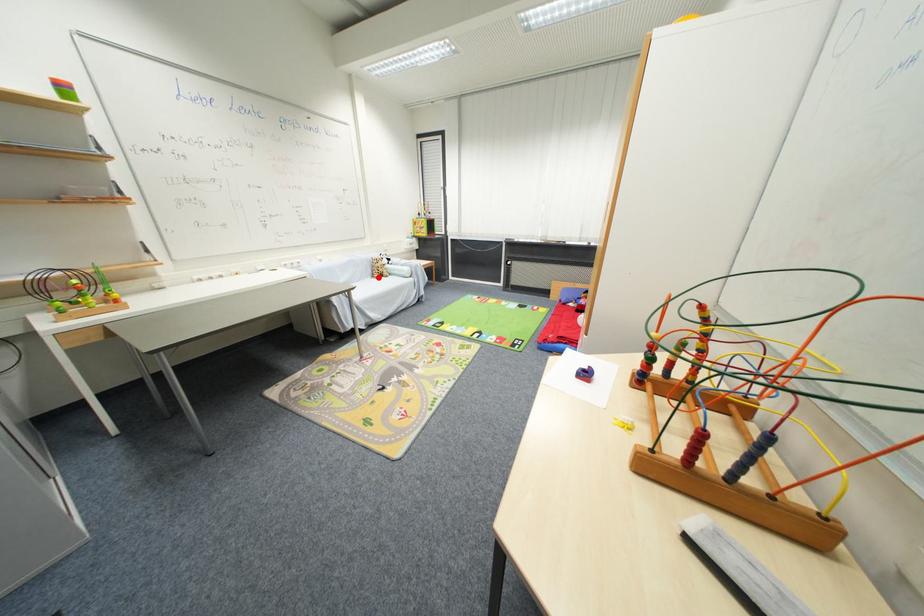
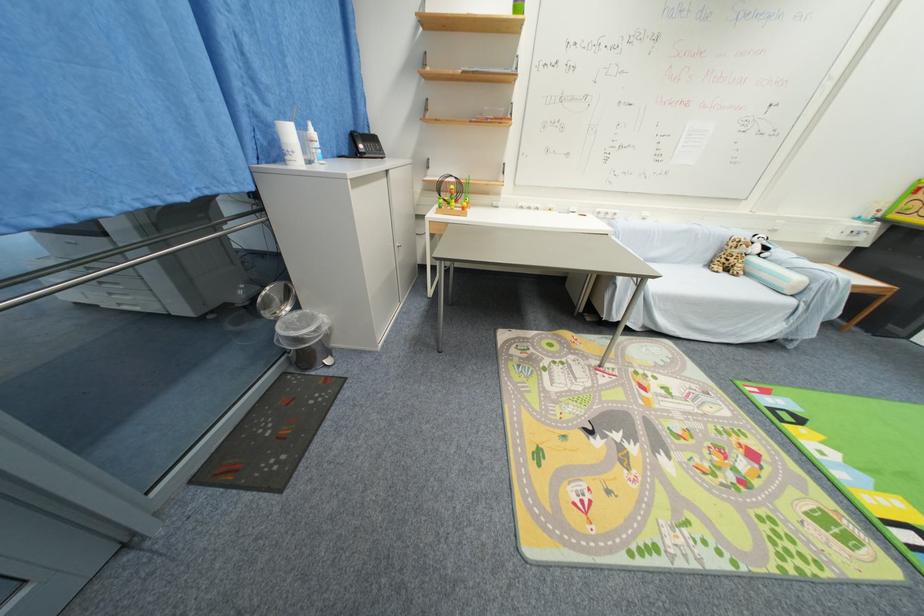
Question: I am providing you with two images of the same scene from different viewpoints. Given a red point in image1, look at the same physical point in image2. Is it:

Choices:
 (A) Closer to the viewpoint
 (B) Farther from the viewpoint

Answer: (B)